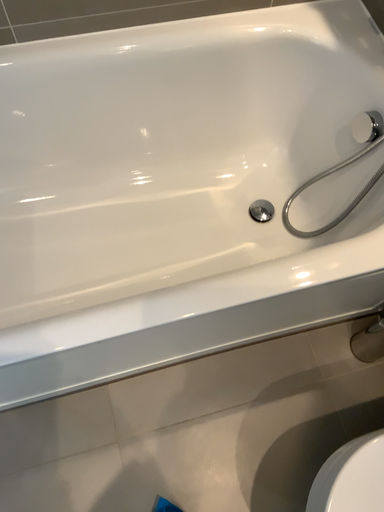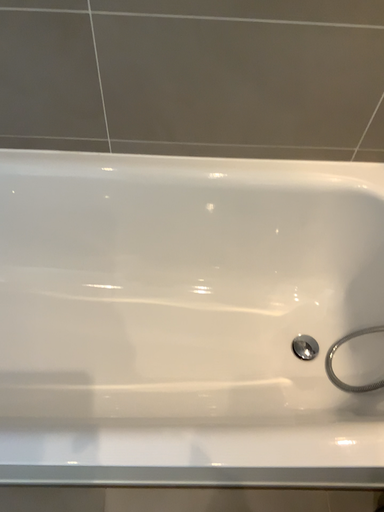
Question: Which way did the camera rotate in the video?

Choices:
 (A) rotated downward
 (B) rotated upward

Answer: (B)